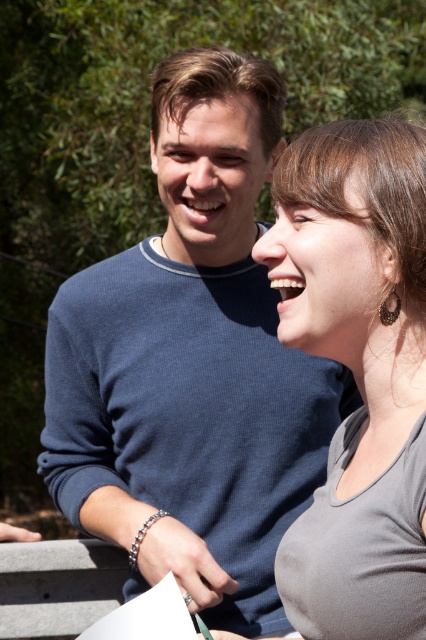
Between blue ribbed sweater at upper left and gray matte tank top at right, which one appears on the left side from the viewer's perspective?

blue ribbed sweater at upper left

Can you confirm if blue ribbed sweater at upper left is thinner than gray matte tank top at right?

Incorrect, blue ribbed sweater at upper left's width is not less than gray matte tank top at right's.

Which is behind, point (294, 394) or point (411, 176)?

The point (294, 394) is behind.

This screenshot has width=426, height=640. What are the coordinates of `blue ribbed sweater at upper left` in the screenshot? It's located at (192, 364).